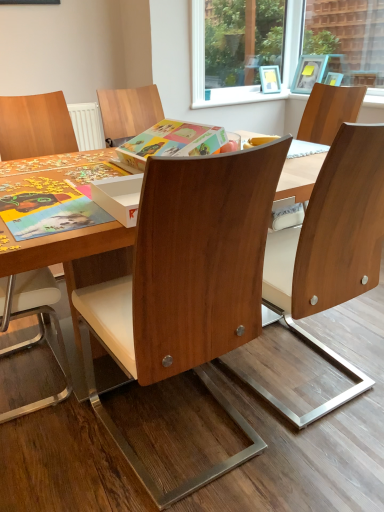
I want to click on vacant space underneath wooden chair at center, arranged as the second chair when viewed from the right (from a real-world perspective), so click(194, 450).